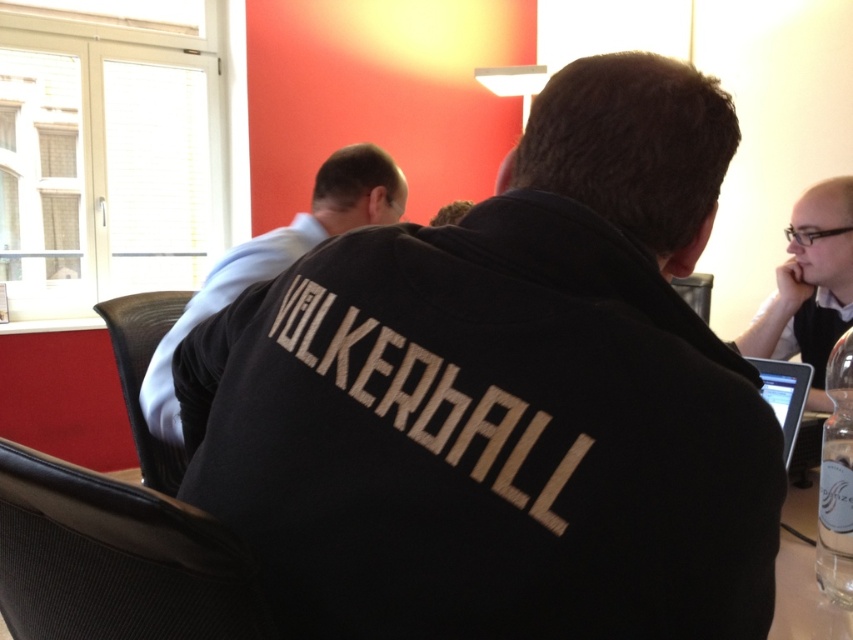
Question: Can you confirm if white shirt at upper left is positioned above black glossy laptop at right?

Choices:
 (A) yes
 (B) no

Answer: (B)

Question: Does black cotton hoodie at center appear under white shirt at upper left?

Choices:
 (A) yes
 (B) no

Answer: (A)

Question: Which point is farther to the camera?

Choices:
 (A) (384, 220)
 (B) (486, 500)
 (C) (805, 384)
 (D) (845, 179)

Answer: (D)

Question: Which object is the farthest from the white shirt at upper left?

Choices:
 (A) matte black tablet at lower right
 (B) black cotton hoodie at center

Answer: (A)

Question: Is white shirt at upper left bigger than matte black tablet at lower right?

Choices:
 (A) yes
 (B) no

Answer: (A)

Question: Considering the real-world distances, which object is closest to the matte black tablet at lower right?

Choices:
 (A) black cotton hoodie at center
 (B) white shirt at upper left
 (C) black glossy laptop at right

Answer: (C)